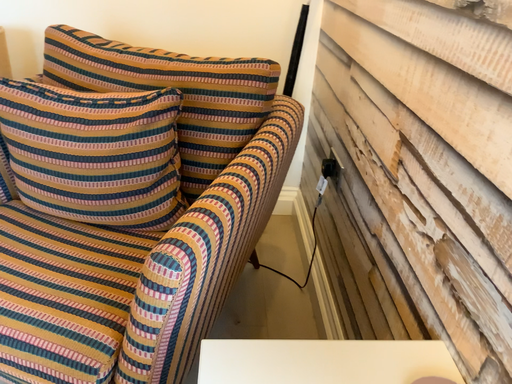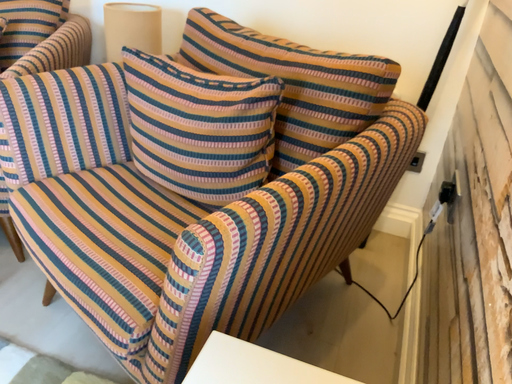
Question: How did the camera likely rotate when shooting the video?

Choices:
 (A) rotated left
 (B) rotated right

Answer: (A)